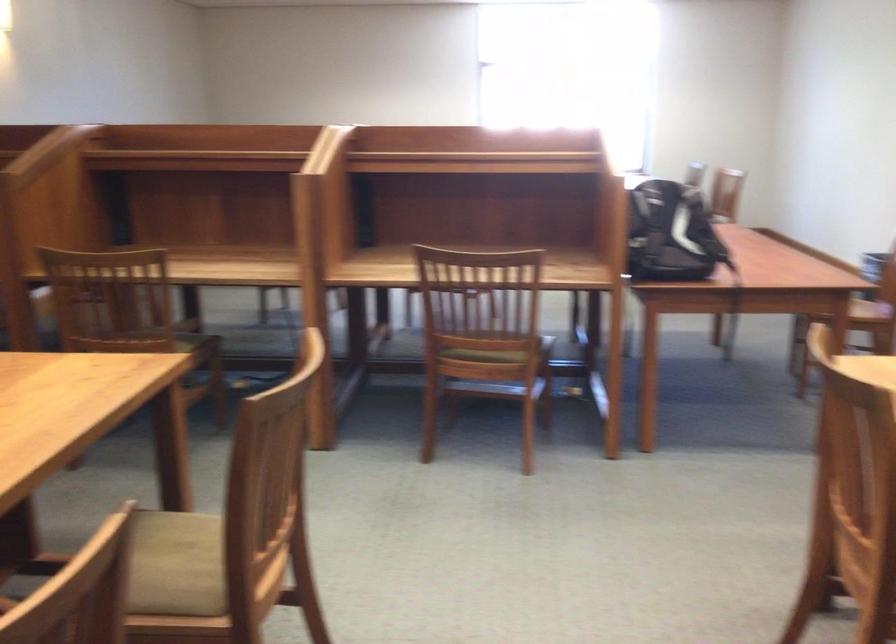
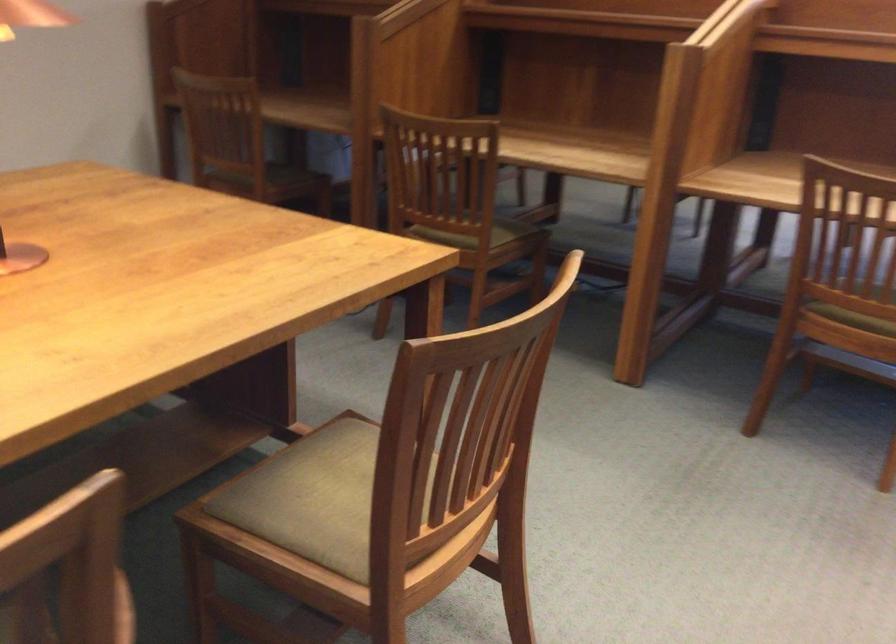
In the second image, find the point that corresponds to pixel 143 569 in the first image.

(314, 498)